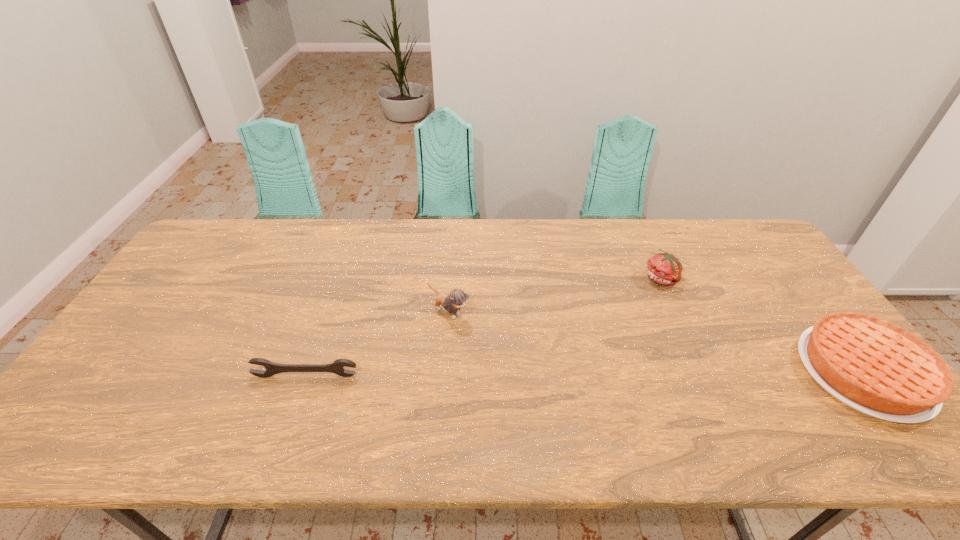
Locate an element on the screen. free space on the desktop that is between the leftmost object and the rightmost object and is positioned on the front-facing side of the tomato is located at coordinates (625, 374).

Where is `vacant space on the desktop that is between the leftmost object and the pie and is positioned on the front-facing side of the third object from right to left`? The height and width of the screenshot is (540, 960). vacant space on the desktop that is between the leftmost object and the pie and is positioned on the front-facing side of the third object from right to left is located at coordinates (537, 374).